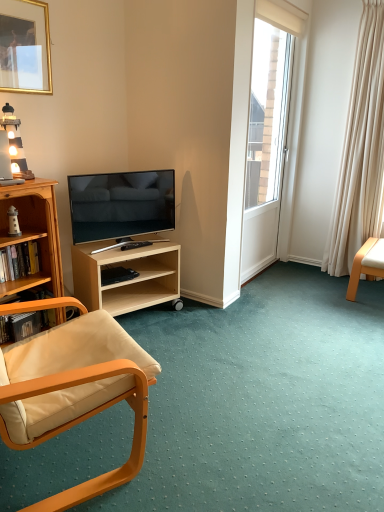
Question: Is black plastic remote control at lower center to the left or to the right of hardcover book at left in the image?

Choices:
 (A) right
 (B) left

Answer: (A)

Question: From a real-world perspective, is black plastic remote control at lower center above or below hardcover book at left?

Choices:
 (A) below
 (B) above

Answer: (A)

Question: Which object is positioned closest to the wooden lighthouse at upper left?

Choices:
 (A) black plastic remote control at lower center
 (B) matte black tv at center left
 (C) white glossy door at upper right
 (D) matte wood chair at left, which ranks as the 1th chair in left-to-right order
 (E) wooden bookshelf at lower left, acting as the 1th shelf starting from the left

Answer: (B)

Question: Which is nearer to the wooden bookshelf at lower left, positioned as the 2th shelf in right-to-left order?

Choices:
 (A) gold metallic picture frame at upper left
 (B) hardcover book at left
 (C) light wood/finishedobject at center, marked as the 2th shelf in a left-to-right arrangement
 (D) white glossy door at upper right
 (E) matte black tv at center left

Answer: (B)